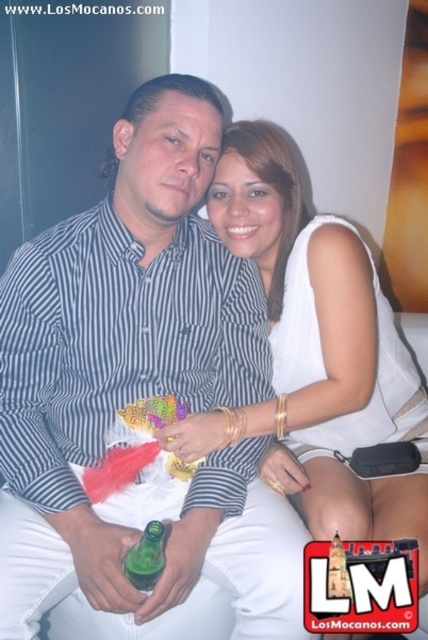
This screenshot has height=640, width=428. Describe the element at coordinates (315, 353) in the screenshot. I see `white satin dress at center` at that location.

Is point (265, 256) in front of point (160, 524)?

No, (265, 256) is further to viewer.

Which is behind, point (231, 417) or point (145, 570)?

The point (231, 417) is behind.

Find the location of a particular element. white satin dress at center is located at coordinates (315, 353).

Which is in front, point (24, 388) or point (318, 353)?

Point (24, 388) is in front.

Which is behind, point (33, 417) or point (356, 289)?

The point (356, 289) is behind.

The image size is (428, 640). Identify the location of striped cotton shirt at center. (139, 387).

Who is taller, striped cotton shirt at center or green glass bottle at center?

With more height is striped cotton shirt at center.

Which is above, striped cotton shirt at center or green glass bottle at center?

striped cotton shirt at center

Which is in front, point (249, 490) or point (133, 552)?

Point (133, 552)

Image resolution: width=428 pixels, height=640 pixels. What are the coordinates of `striped cotton shirt at center` in the screenshot? It's located at (139, 387).